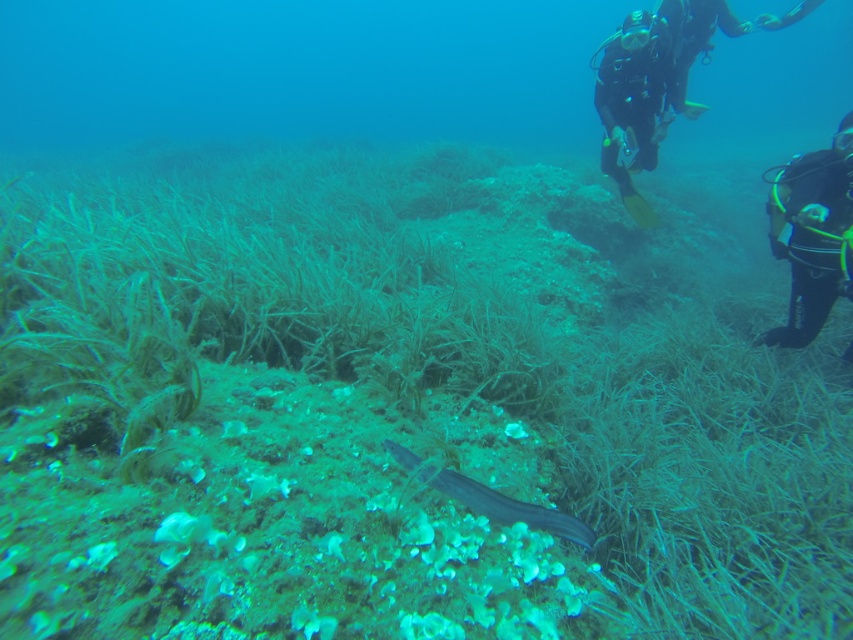
You are a marine biologist observing this underwater scene. You notice a point marked at coordinate (811,234). What object does this point correspond to?

The point at coordinate (811,234) corresponds to the black neoprene wetsuit at right.